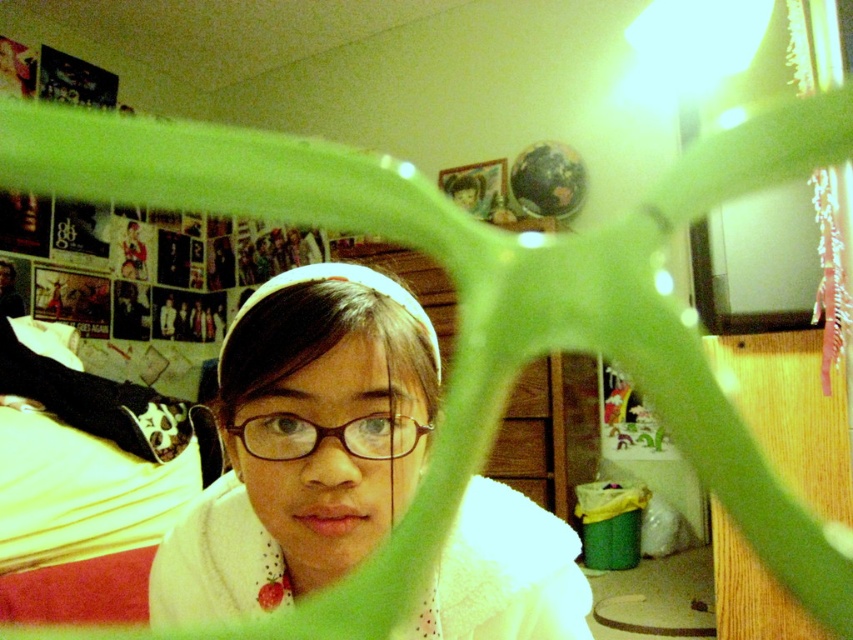
Question: Does white fluffy robe at center have a lesser width compared to brown matte glasses at center?

Choices:
 (A) no
 (B) yes

Answer: (A)

Question: Is white fluffy robe at center to the left of brown matte glasses at center from the viewer's perspective?

Choices:
 (A) no
 (B) yes

Answer: (A)

Question: Can you confirm if white fluffy robe at center is positioned to the right of brown matte glasses at center?

Choices:
 (A) no
 (B) yes

Answer: (B)

Question: Among these points, which one is nearest to the camera?

Choices:
 (A) (238, 429)
 (B) (372, 451)

Answer: (B)

Question: Which point is farther from the camera taking this photo?

Choices:
 (A) (283, 433)
 (B) (299, 356)

Answer: (A)